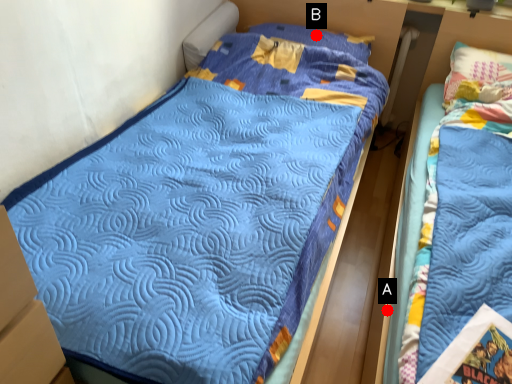
Question: Two points are circled on the image, labeled by A and B beside each circle. Which point is farther to the camera?

Choices:
 (A) A is further
 (B) B is further

Answer: (B)